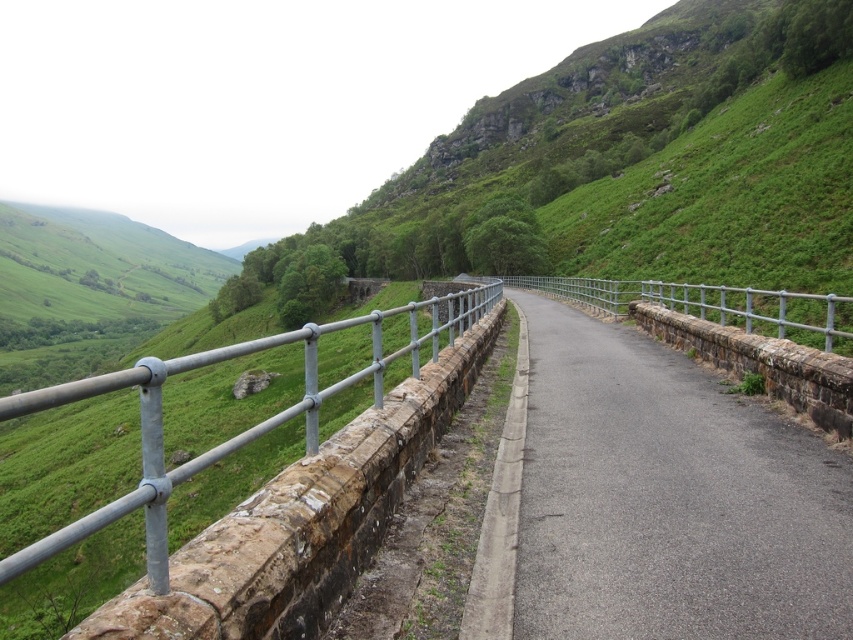
Who is higher up, metallic gray railing at left or silver metallic fence at center?

Positioned higher is silver metallic fence at center.

Between metallic gray railing at left and silver metallic fence at center, which one appears on the right side from the viewer's perspective?

silver metallic fence at center is more to the right.

Is point (370, 544) positioned after point (724, 317)?

No, it is not.

What are the coordinates of `metallic gray railing at left` in the screenshot? It's located at (305, 518).

Can you confirm if asphalt road at center is smaller than silver metallic fence at center?

Yes.

You are a GUI agent. You are given a task and a screenshot of the screen. Output one action in this format:
    pyautogui.click(x=<x>, y=<y>)
    Task: Click on the asphalt road at center
    
    Given the screenshot: What is the action you would take?
    pyautogui.click(x=668, y=499)

Between point (596, 376) and point (782, 320), which one is positioned in front?

Point (782, 320) is more forward.

Identify the location of asphalt road at center. (668, 499).

Between asphalt road at center and metallic gray railing at left, which one is positioned lower?

asphalt road at center is below.

Which is behind, point (532, 353) or point (260, 529)?

Positioned behind is point (532, 353).

This screenshot has height=640, width=853. Identify the location of asphalt road at center. (668, 499).